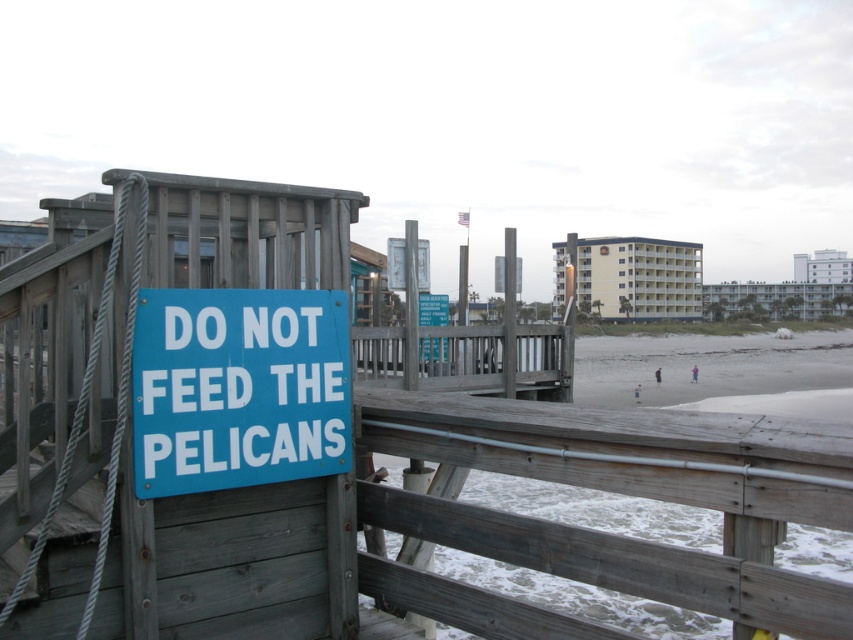
Question: Can you confirm if gray wooden rail at center is positioned to the right of blue matte sign at center?

Choices:
 (A) no
 (B) yes

Answer: (B)

Question: Which point is farther to the camera?

Choices:
 (A) (193, 456)
 (B) (608, 416)

Answer: (A)

Question: Does gray wooden rail at center have a greater width compared to blue matte sign at center?

Choices:
 (A) yes
 (B) no

Answer: (A)

Question: Does gray wooden rail at center come in front of blue matte sign at center?

Choices:
 (A) no
 (B) yes

Answer: (B)

Question: Which of the following is the farthest from the observer?

Choices:
 (A) blue matte sign at center
 (B) gray wooden rail at center

Answer: (A)